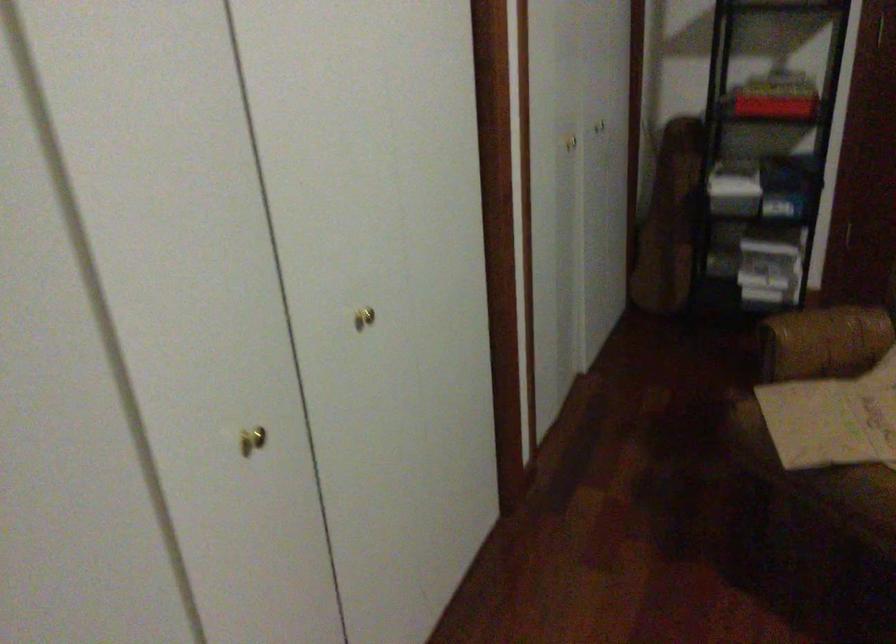
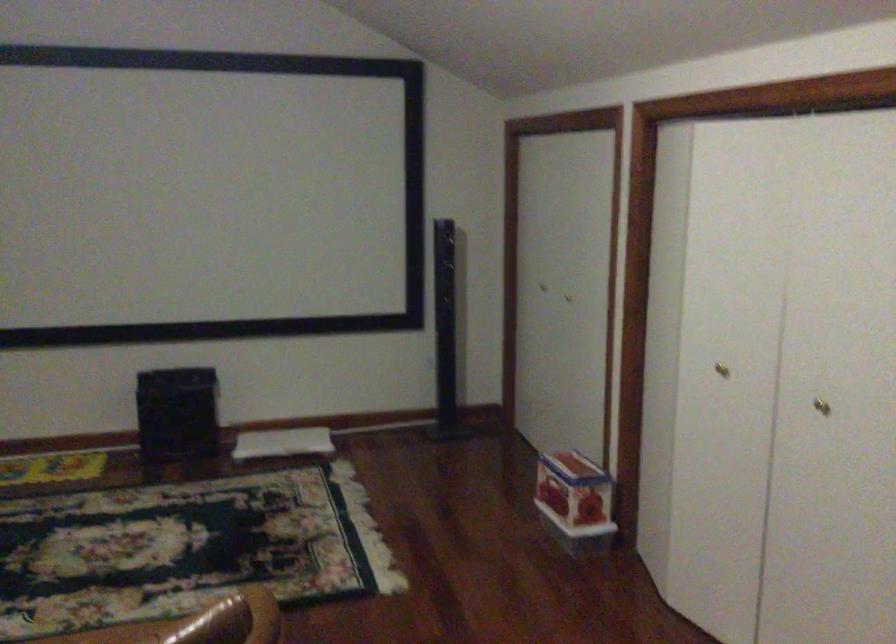
Find the pixel in the second image that matches (245,455) in the first image.

(721, 368)